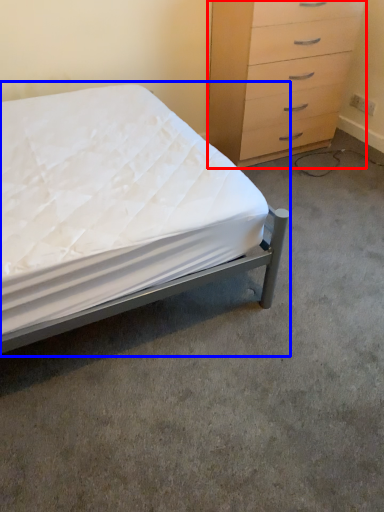
Question: Which object is further to the camera taking this photo, chest of drawers (highlighted by a red box) or bed (highlighted by a blue box)?

Choices:
 (A) chest of drawers
 (B) bed

Answer: (A)